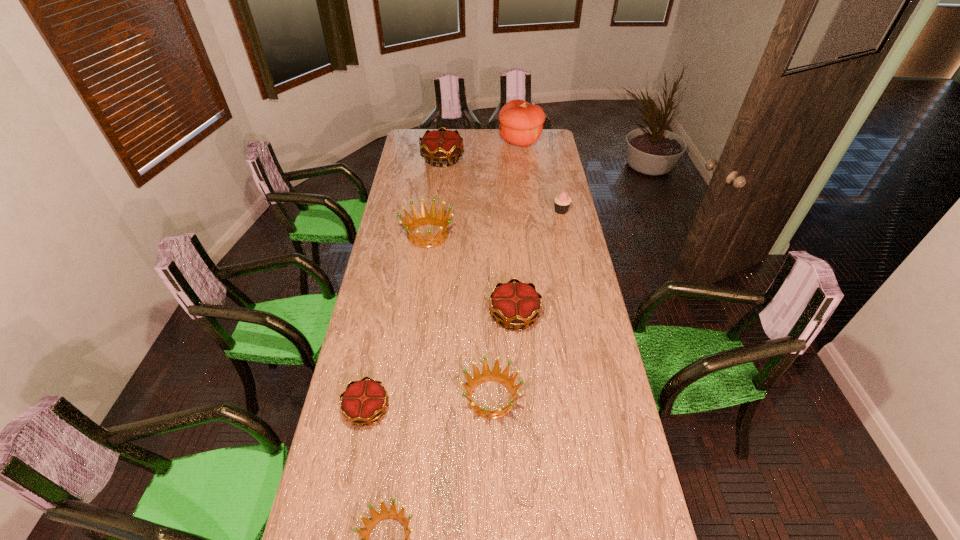
Identify the location of crown located in the far edge section of the desktop. (441, 145).

Locate an element on the screen. The image size is (960, 540). pumpkin situated at the right edge is located at coordinates (521, 123).

You are a GUI agent. You are given a task and a screenshot of the screen. Output one action in this format:
    pyautogui.click(x=<x>, y=<y>)
    Task: Click on the cupcake that is positioned at the right edge
    Image resolution: width=960 pixels, height=540 pixels.
    Given the screenshot: What is the action you would take?
    pyautogui.click(x=562, y=202)

Where is `object present at the far left corner`? object present at the far left corner is located at coordinates (441, 145).

Locate an element on the screen. object that is at the far right corner is located at coordinates (521, 123).

Identify the location of free spot at the far edge of the desktop. (492, 130).

Image resolution: width=960 pixels, height=540 pixels. Identify the location of vacant space at the left edge of the desktop. (406, 256).

Identify the location of vacant area at the right edge. (602, 341).

The image size is (960, 540). Identify the location of empty space between the smallest gold crown and the second farthest golden crown. (429, 403).

Image resolution: width=960 pixels, height=540 pixels. I want to click on free space that is in between the farthest golden crown and the pumpkin, so click(x=474, y=188).